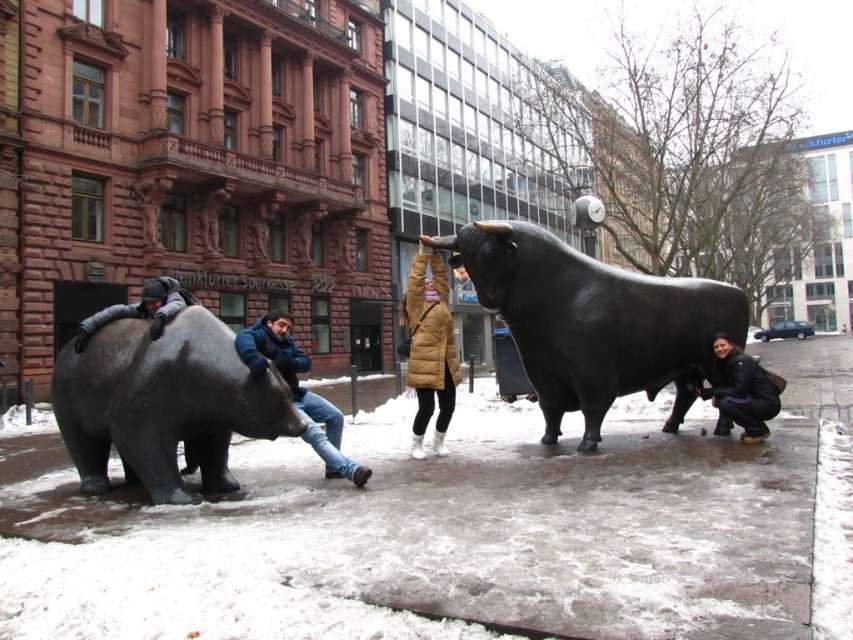
Measure the distance between shiny black bull at center and dark gray metallic bear at left.

4.89 meters

At what (x,y) coordinates should I click in order to perform the action: click on shiny black bull at center. Please return your answer as a coordinate pair (x, y). Looking at the image, I should click on (595, 323).

Can you confirm if shiny black bull at center is wider than brown puffer jacket at center?

Indeed, shiny black bull at center has a greater width compared to brown puffer jacket at center.

The width and height of the screenshot is (853, 640). What are the coordinates of `shiny black bull at center` in the screenshot? It's located at (595, 323).

Find the location of a particular element. shiny black bull at center is located at coordinates (595, 323).

Locate an element on the screen. This screenshot has width=853, height=640. brown puffer jacket at center is located at coordinates (428, 348).

Is brown puffer jacket at center wider than blue denim jeans at center?

In fact, brown puffer jacket at center might be narrower than blue denim jeans at center.

Who is more forward, (439, 436) or (322, 429)?

Point (322, 429) is in front.

Find the location of a particular element. The height and width of the screenshot is (640, 853). brown puffer jacket at center is located at coordinates (428, 348).